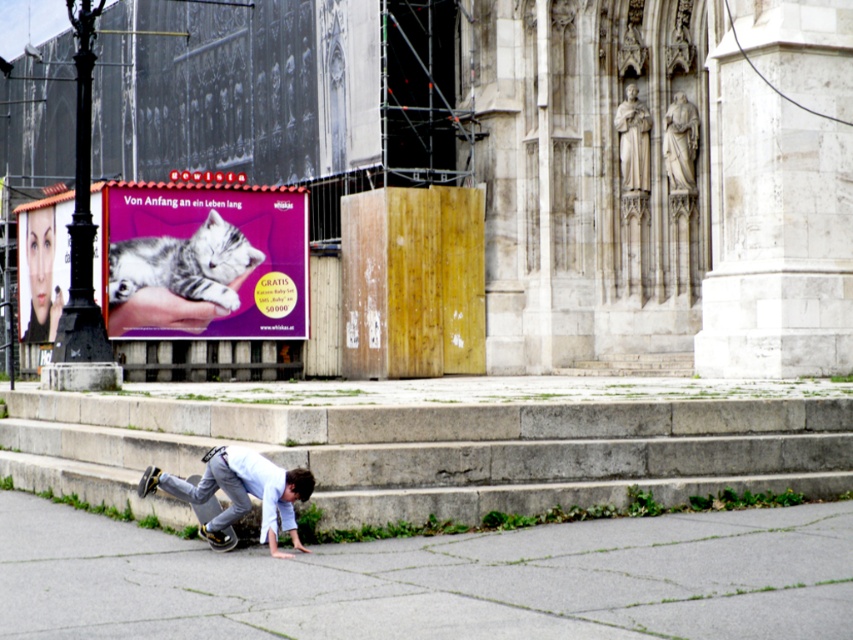
You are an urban planner analyzing the billboard in the scene. You need to determine if the matte purple poster at upper center is smaller in size compared to the matte purple cat at upper left. Based on the scene description, what can you conclude?

The matte purple poster at upper center occupies less space than the matte purple cat at upper left, so it is smaller in size.

You are standing at the edge of a park and see the gray concrete pavement at lower left. If you want to walk towards it, how many steps would you need to take if each step covers 2 feet?

The gray concrete pavement at lower left is 29.40 feet away from viewer. Dividing 29.40 by 2 gives approximately 14.7 steps, so you would need to take around 15 steps to reach it.

You are a pedestrian looking at the billboard in the scene. Which object, the matte purple poster at upper center or the matte purple cat at upper left, is closer to you?

The matte purple poster at upper center is closer to you because it is positioned over the matte purple cat at upper left, indicating it is in front.